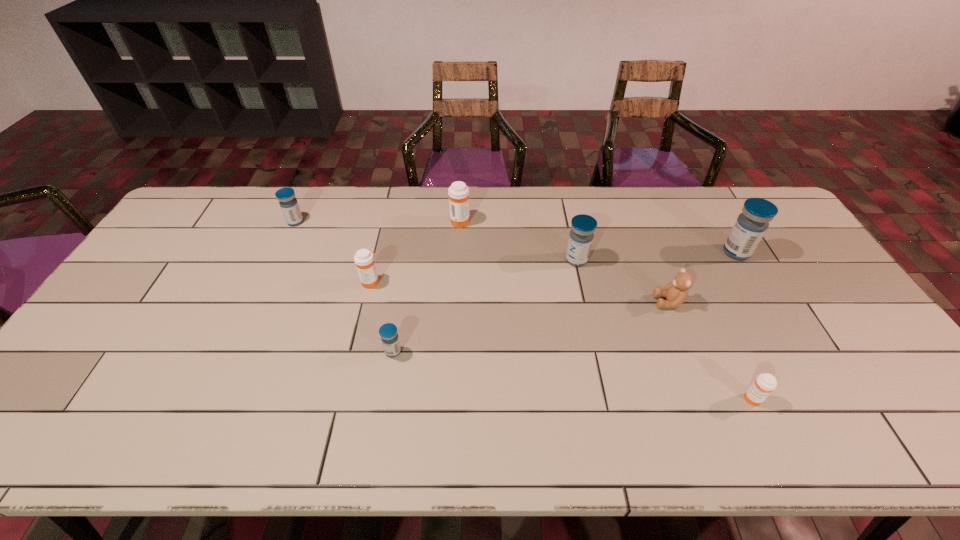
Find the location of a particular element. This screenshot has width=960, height=540. vacant space located on the right of the seventh object from right to left is located at coordinates (441, 282).

At what (x,y) coordinates should I click in order to perform the action: click on vacant space located 0.260m on the front-facing side of the brown teddy bear. Please return your answer as a coordinate pair (x, y). This screenshot has width=960, height=540. Looking at the image, I should click on (563, 302).

At what (x,y) coordinates should I click in order to perform the action: click on vacant space located 0.280m on the front-facing side of the brown teddy bear. Please return your answer as a coordinate pair (x, y). This screenshot has height=540, width=960. Looking at the image, I should click on (556, 302).

This screenshot has width=960, height=540. What are the coordinates of `free spot located 0.140m on the front-facing side of the brown teddy bear` in the screenshot? It's located at tap(605, 302).

The height and width of the screenshot is (540, 960). Identify the location of free location located 0.160m on the right of the sixth farthest medicine. (464, 352).

The height and width of the screenshot is (540, 960). I want to click on vacant space positioned 0.050m on the front of the nearest medicine, so click(x=767, y=430).

Identify the location of vacant space at the far edge of the desktop. (387, 201).

This screenshot has height=540, width=960. What are the coordinates of `vacant region at the near edge of the desktop` in the screenshot? It's located at [x=515, y=431].

Image resolution: width=960 pixels, height=540 pixels. I want to click on vacant space at the left edge of the desktop, so click(x=95, y=373).

In the image, there is a desktop. At what (x,y) coordinates should I click in order to perform the action: click on vacant region at the right edge. Please return your answer as a coordinate pair (x, y). Looking at the image, I should click on (875, 367).